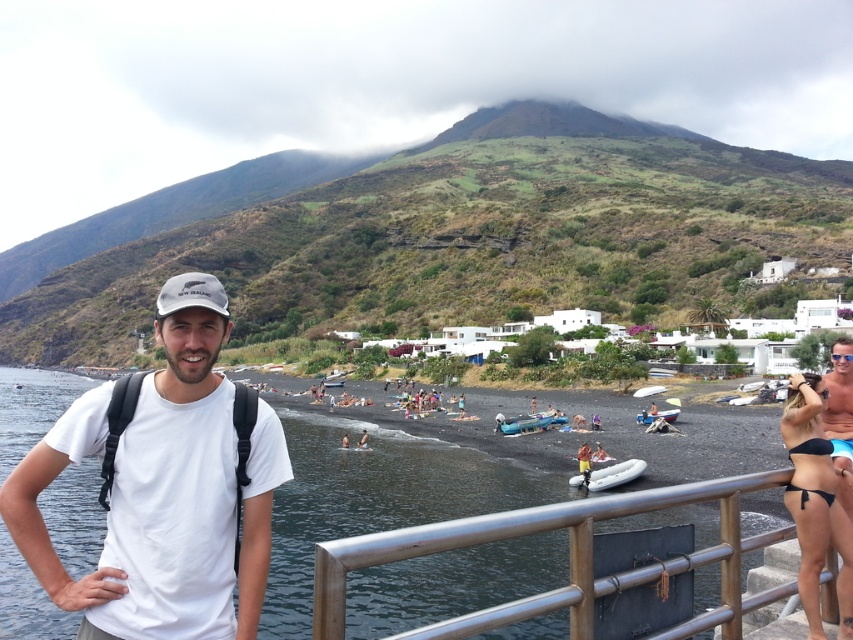
You are a photographer trying to capture a shot of the two boats in the scene. The inflatable blue boat at center and the white plastic boat at center. Based on their positions, which boat should you focus on first if you want to include both in your frame without moving the camera?

The inflatable blue boat at center is below the white plastic boat at center, so you should focus on the white plastic boat at center first to ensure both are in the frame.

You are a photographer trying to capture a wide shot of the beach scene. You notice the silver metallic railing at lower right and the inflatable blue boat at center. Which object should you position closer to the edge of your frame to ensure both fit in the shot?

The silver metallic railing at lower right has a larger width than the inflatable blue boat at center. To ensure both fit in the shot, position the silver metallic railing at lower right closer to the edge of the frame since it is wider and requires more space.